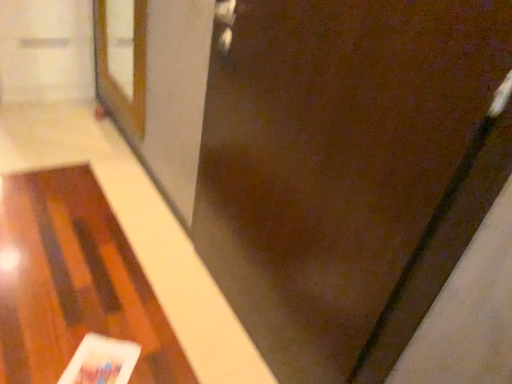
Question: Does white glossy magazine at lower left have a lesser height compared to brown wooden screen door at upper left?

Choices:
 (A) yes
 (B) no

Answer: (A)

Question: Can we say white glossy magazine at lower left lies outside brown wooden screen door at upper left?

Choices:
 (A) yes
 (B) no

Answer: (A)

Question: Is white glossy magazine at lower left bigger than brown wooden screen door at upper left?

Choices:
 (A) yes
 (B) no

Answer: (B)

Question: Is white glossy magazine at lower left positioned behind brown wooden screen door at upper left?

Choices:
 (A) yes
 (B) no

Answer: (B)

Question: From a real-world perspective, is white glossy magazine at lower left beneath brown wooden screen door at upper left?

Choices:
 (A) no
 (B) yes

Answer: (B)

Question: From a real-world perspective, is white glossy magazine at lower left physically above brown wooden screen door at upper left?

Choices:
 (A) no
 (B) yes

Answer: (A)

Question: Would you say brown wooden screen door at upper left is part of wooden table at lower left's contents?

Choices:
 (A) yes
 (B) no

Answer: (B)

Question: Can you confirm if wooden table at lower left is shorter than brown wooden screen door at upper left?

Choices:
 (A) no
 (B) yes

Answer: (B)

Question: Is wooden table at lower left further to the viewer compared to brown wooden screen door at upper left?

Choices:
 (A) no
 (B) yes

Answer: (A)

Question: Is wooden table at lower left not within brown wooden screen door at upper left?

Choices:
 (A) no
 (B) yes

Answer: (B)

Question: Is wooden table at lower left facing away from brown wooden screen door at upper left?

Choices:
 (A) no
 (B) yes

Answer: (A)

Question: Is wooden table at lower left to the left of brown wooden screen door at upper left from the viewer's perspective?

Choices:
 (A) yes
 (B) no

Answer: (A)

Question: Is wooden table at lower left at the right side of brown matte door at center?

Choices:
 (A) yes
 (B) no

Answer: (B)